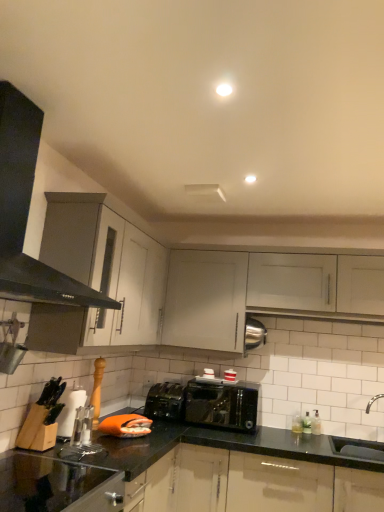
Question: Does shiny black toaster at center appear on the right side of black granite countertop at lower left?

Choices:
 (A) yes
 (B) no

Answer: (A)

Question: Is shiny black toaster at center surrounding black granite countertop at lower left?

Choices:
 (A) yes
 (B) no

Answer: (B)

Question: Is shiny black toaster at center turned away from black granite countertop at lower left?

Choices:
 (A) yes
 (B) no

Answer: (B)

Question: Considering the relative sizes of shiny black toaster at center and black granite countertop at lower left in the image provided, is shiny black toaster at center taller than black granite countertop at lower left?

Choices:
 (A) yes
 (B) no

Answer: (B)

Question: Considering the relative positions of shiny black toaster at center and black granite countertop at lower left in the image provided, is shiny black toaster at center to the left of black granite countertop at lower left from the viewer's perspective?

Choices:
 (A) no
 (B) yes

Answer: (A)

Question: Considering the relative sizes of shiny black toaster at center and black granite countertop at lower left in the image provided, is shiny black toaster at center shorter than black granite countertop at lower left?

Choices:
 (A) yes
 (B) no

Answer: (A)

Question: Is white ceramic sink at lower right, which appears as the second sink when ordered from the bottom, shorter than white matte cabinet at upper center, which is counted as the first cabinetry, starting from the right?

Choices:
 (A) no
 (B) yes

Answer: (B)

Question: From a real-world perspective, does white ceramic sink at lower right, which appears as the first sink when viewed from the top, sit lower than white matte cabinet at upper center, the 2th cabinetry viewed from the left?

Choices:
 (A) yes
 (B) no

Answer: (A)

Question: From a real-world perspective, is white ceramic sink at lower right, which appears as the first sink when viewed from the top, on top of white matte cabinet at upper center, which is counted as the first cabinetry, starting from the right?

Choices:
 (A) yes
 (B) no

Answer: (B)

Question: Is white ceramic sink at lower right, which appears as the second sink when ordered from the bottom, facing towards white matte cabinet at upper center, the 2th cabinetry viewed from the left?

Choices:
 (A) no
 (B) yes

Answer: (A)

Question: From the image's perspective, would you say white ceramic sink at lower right, which appears as the first sink when viewed from the top, is positioned over white matte cabinet at upper center, the 2th cabinetry viewed from the left?

Choices:
 (A) no
 (B) yes

Answer: (A)

Question: Would you say white ceramic sink at lower right, which appears as the first sink when viewed from the top, contains white matte cabinet at upper center, which is counted as the first cabinetry, starting from the right?

Choices:
 (A) yes
 (B) no

Answer: (B)

Question: From the image's perspective, does white matte cabinet at upper center, which is counted as the first cabinetry, starting from the right, appear higher than white ceramic sink at lower right, which appears as the second sink when ordered from the bottom?

Choices:
 (A) yes
 (B) no

Answer: (A)